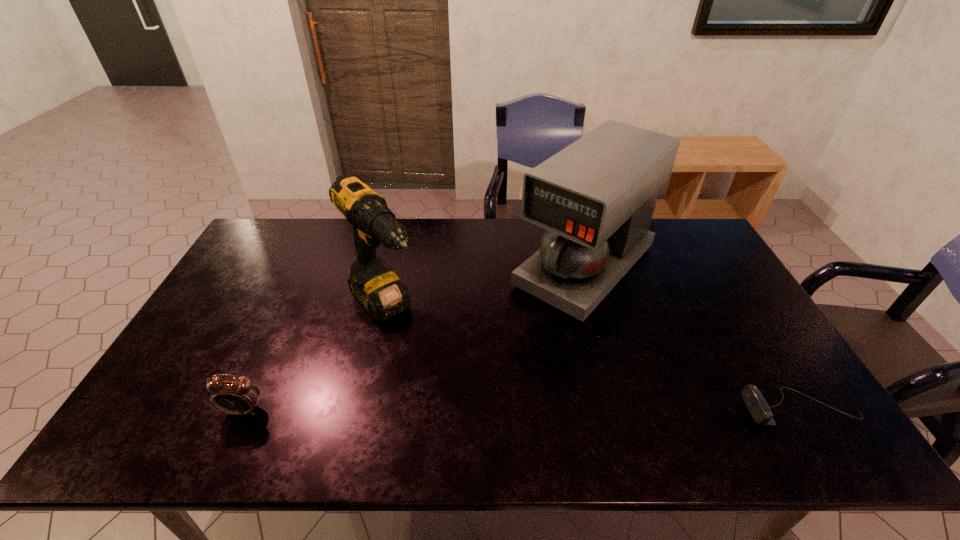
Locate an element on the screen. the second shortest object is located at coordinates (234, 395).

Where is `the leftmost object`? The width and height of the screenshot is (960, 540). the leftmost object is located at coordinates (234, 395).

The width and height of the screenshot is (960, 540). Find the location of `the shortest object`. the shortest object is located at coordinates pyautogui.click(x=759, y=409).

Find the location of a particular element. Image resolution: width=960 pixels, height=540 pixels. the rightmost object is located at coordinates (759, 409).

This screenshot has height=540, width=960. I want to click on the third object from left to right, so click(596, 197).

This screenshot has height=540, width=960. I want to click on the second object from left to right, so 373,283.

Where is `vacant area located 0.250m on the front-facing side of the rightmost object`? vacant area located 0.250m on the front-facing side of the rightmost object is located at coordinates (636, 409).

Locate an element on the screen. free spot located 0.330m on the front-facing side of the rightmost object is located at coordinates (603, 409).

Where is `vacant space situated on the front-facing side of the rightmost object`? This screenshot has height=540, width=960. vacant space situated on the front-facing side of the rightmost object is located at coordinates (595, 409).

Identify the location of free space located on the carafe side of the coffee maker. (468, 385).